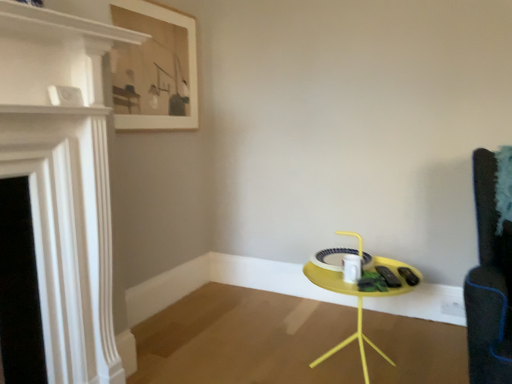
Question: Is white glossy fireplace at left bigger or smaller than wooden framed artwork at upper left?

Choices:
 (A) small
 (B) big

Answer: (B)

Question: From the image's perspective, relative to wooden framed artwork at upper left, is white glossy fireplace at left above or below?

Choices:
 (A) below
 (B) above

Answer: (A)

Question: Which of these objects is positioned farthest from the wooden framed artwork at upper left?

Choices:
 (A) yellow matte table at center
 (B) white glossy fireplace at left

Answer: (A)

Question: Based on their relative distances, which object is nearer to the white glossy fireplace at left?

Choices:
 (A) wooden framed artwork at upper left
 (B) yellow matte table at center

Answer: (A)